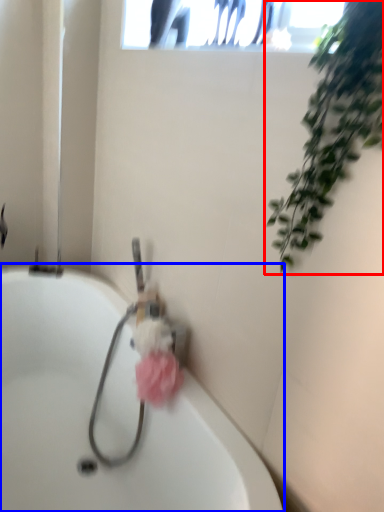
Question: Which object is further to the camera taking this photo, houseplant (highlighted by a red box) or bathtub (highlighted by a blue box)?

Choices:
 (A) houseplant
 (B) bathtub

Answer: (B)